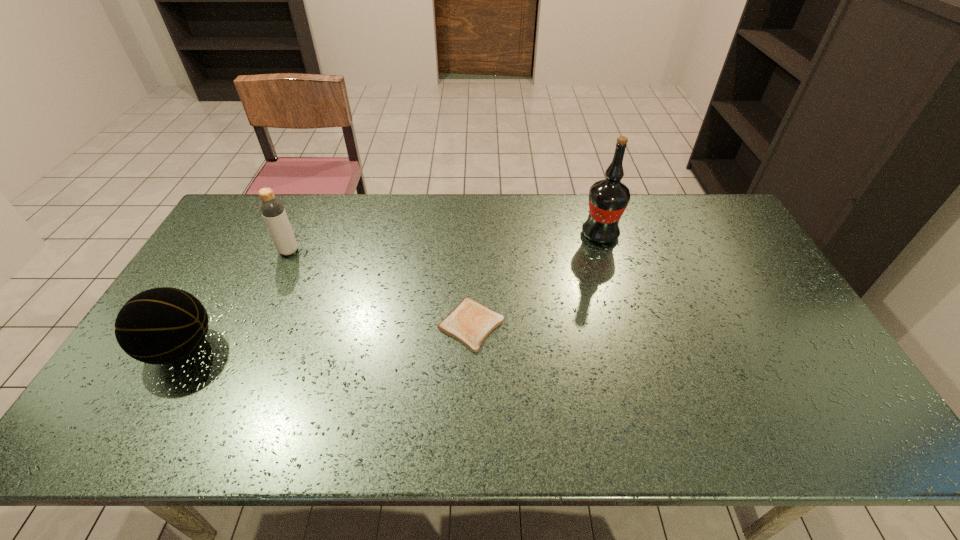
Identify the location of vacant space in between the leftmost object and the toast. The width and height of the screenshot is (960, 540). (326, 336).

Identify the location of free space that is in between the third shortest object and the wine bottle. The width and height of the screenshot is (960, 540). (444, 243).

Locate an element on the screen. The image size is (960, 540). blank region between the leftmost object and the rightmost object is located at coordinates pos(391,292).

The image size is (960, 540). Identify the location of vacant region between the second object from right to left and the tallest object. (536, 279).

Identify the location of unoccupied position between the toast and the third shortest object. The image size is (960, 540). (380, 288).

I want to click on free spot between the leftmost object and the shortest object, so click(326, 336).

Locate an element on the screen. The image size is (960, 540). unoccupied area between the shortest object and the rightmost object is located at coordinates (536, 279).

I want to click on free space between the basketball and the rightmost object, so click(391, 292).

At what (x,y) coordinates should I click in order to perform the action: click on vacant space that is in between the shortest object and the third tallest object. Please return your answer as a coordinate pair (x, y). This screenshot has width=960, height=540. Looking at the image, I should click on (326, 336).

Find the location of `free spot between the wine bottle and the leftmost object`. free spot between the wine bottle and the leftmost object is located at coordinates (391, 292).